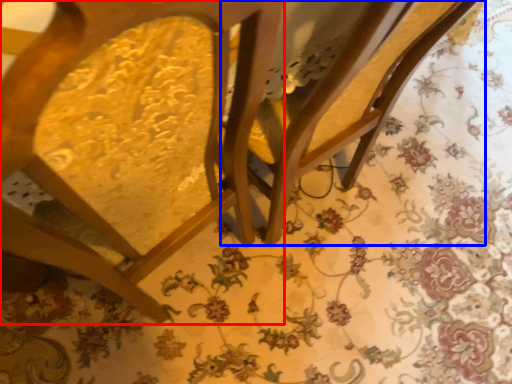
Question: Which object appears closest to the camera in this image, chair (highlighted by a red box) or swivel chair (highlighted by a blue box)?

Choices:
 (A) chair
 (B) swivel chair

Answer: (A)